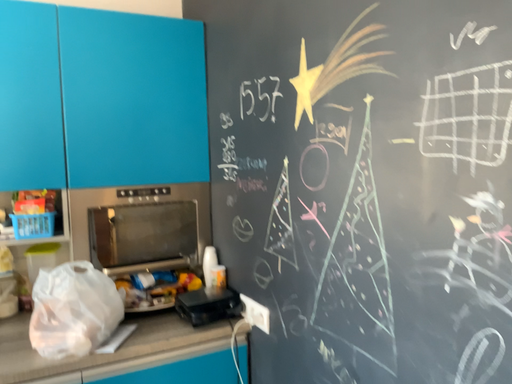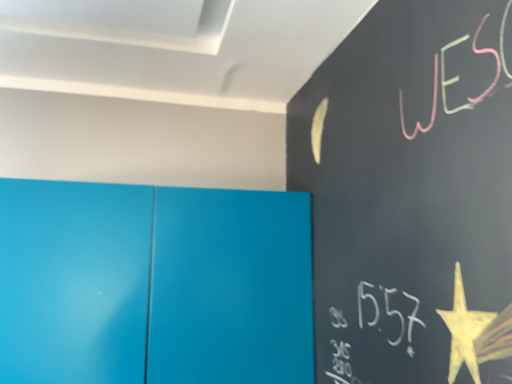
Question: Which way did the camera rotate in the video?

Choices:
 (A) rotated left
 (B) rotated right

Answer: (A)